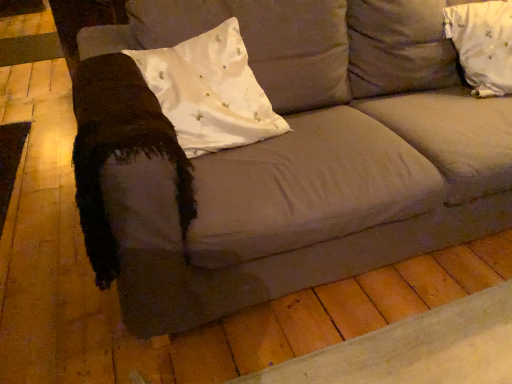
Question: In the image, is white satin pillow at upper right, which appears as the 2th pillow when viewed from the left, on the left side or the right side of white satin pillow at left, positioned as the 2th pillow in right-to-left order?

Choices:
 (A) left
 (B) right

Answer: (B)

Question: From a real-world perspective, is white satin pillow at upper right, which appears as the 2th pillow when viewed from the left, above or below white satin pillow at left, positioned as the 2th pillow in right-to-left order?

Choices:
 (A) below
 (B) above

Answer: (A)

Question: From the image's perspective, is white satin pillow at upper right, acting as the 1th pillow starting from the right, above or below white satin pillow at left, positioned as the 2th pillow in right-to-left order?

Choices:
 (A) below
 (B) above

Answer: (B)

Question: From the image's perspective, relative to white satin pillow at upper right, acting as the 1th pillow starting from the right, is white satin pillow at left, positioned as the 1th pillow in left-to-right order, above or below?

Choices:
 (A) below
 (B) above

Answer: (A)

Question: Choose the correct answer: Is white satin pillow at left, positioned as the 2th pillow in right-to-left order, inside white satin pillow at upper right, which appears as the 2th pillow when viewed from the left, or outside it?

Choices:
 (A) outside
 (B) inside

Answer: (A)

Question: From a real-world perspective, is white satin pillow at left, positioned as the 2th pillow in right-to-left order, above or below white satin pillow at upper right, acting as the 1th pillow starting from the right?

Choices:
 (A) above
 (B) below

Answer: (A)

Question: Is point (266, 114) closer or farther from the camera than point (490, 87)?

Choices:
 (A) farther
 (B) closer

Answer: (B)